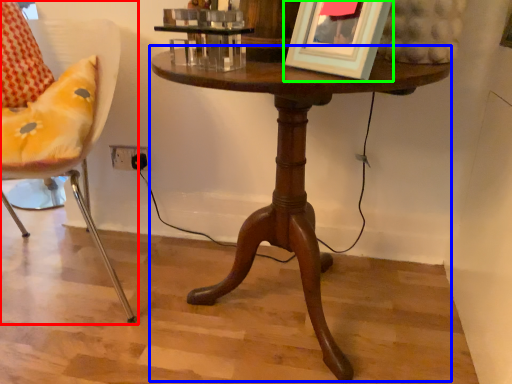
Question: Based on their relative distances, which object is nearer to chair (highlighted by a red box)? Choose from table (highlighted by a blue box) and picture frame (highlighted by a green box).

Choices:
 (A) table
 (B) picture frame

Answer: (A)